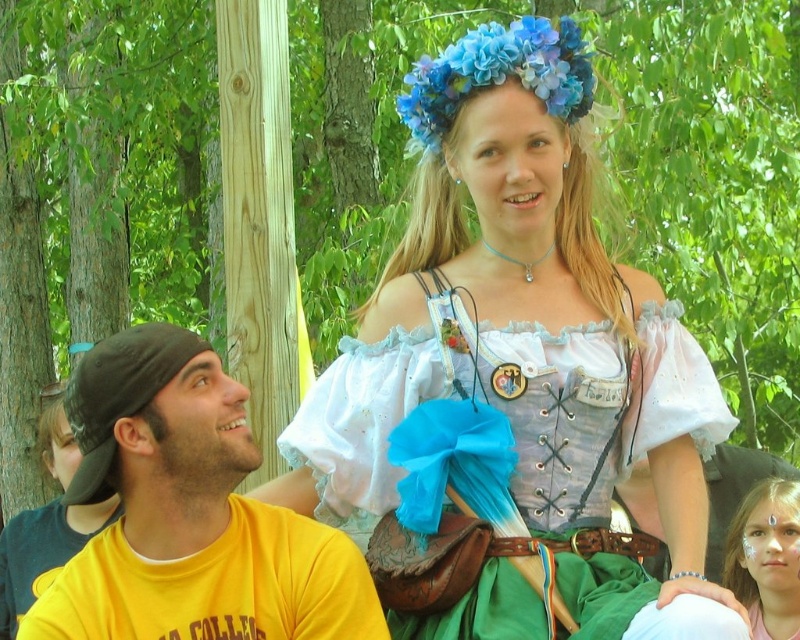
Does point (678, 528) come in front of point (752, 561)?

Yes, point (678, 528) is in front of point (752, 561).

Who is taller, matte white blouse at center or matte pink face paint at lower right?

Standing taller between the two is matte white blouse at center.

Does point (484, 424) lie behind point (729, 564)?

That is False.

Find the location of a particular element. Image resolution: width=800 pixels, height=640 pixels. matte white blouse at center is located at coordinates (516, 374).

Based on the photo, is matte white blouse at center below yellow cotton t-shirt at lower left?

No, matte white blouse at center is not below yellow cotton t-shirt at lower left.

You are a GUI agent. You are given a task and a screenshot of the screen. Output one action in this format:
    pyautogui.click(x=<x>, y=<y>)
    Task: Click on the matte white blouse at center
    The image size is (800, 640).
    Given the screenshot: What is the action you would take?
    pyautogui.click(x=516, y=374)

The image size is (800, 640). What are the coordinates of `matte white blouse at center` in the screenshot? It's located at (516, 374).

Image resolution: width=800 pixels, height=640 pixels. What are the coordinates of `matte white blouse at center` in the screenshot? It's located at (516, 374).

From the picture: Can you confirm if yellow cotton t-shirt at lower left is taller than matte pink face paint at lower right?

Yes, yellow cotton t-shirt at lower left is taller than matte pink face paint at lower right.

Does yellow cotton t-shirt at lower left have a lesser height compared to matte pink face paint at lower right?

In fact, yellow cotton t-shirt at lower left may be taller than matte pink face paint at lower right.

Does point (100, 385) lie in front of point (786, 568)?

That is True.

This screenshot has height=640, width=800. I want to click on yellow cotton t-shirt at lower left, so click(x=188, y=513).